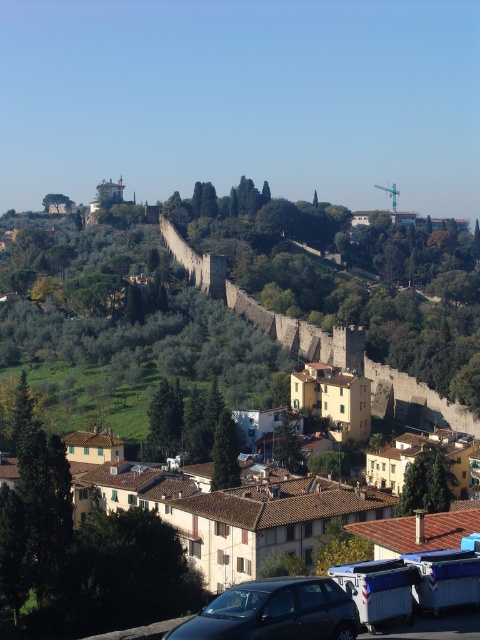
From the picture: You are a tourist standing at the base of the hill in front of the yellow stucco buildings at center and the shiny black car at lower center. You want to take a photo of both objects in the same frame. Which object should you position closer to the camera to ensure both are fully visible?

To capture both the yellow stucco buildings at center and the shiny black car at lower center in the same frame, position the shiny black car at lower center closer to the camera. Since the yellow stucco buildings at center are taller than the shiny black car at lower center, moving the car forward will help balance their sizes in the photo.

You are a tourist standing at the bottom of the hill looking up at the scene. You see the yellow stucco buildings at center and the shiny black car at lower center. Which object is closer to you?

The shiny black car at lower center is behind the yellow stucco buildings at center, so the yellow stucco buildings at center are closer to you.